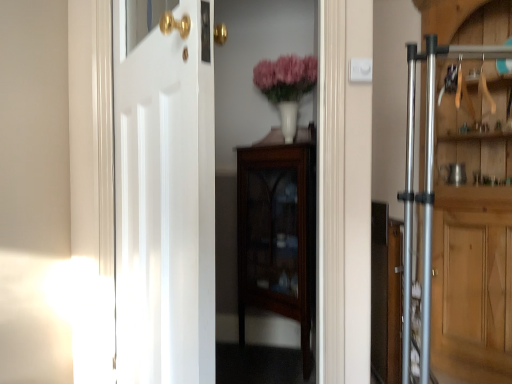
Question: Considering the relative sizes of pink matte vase at upper center and silver metallic door at right, the 2th door in the front-to-back sequence, in the image provided, is pink matte vase at upper center bigger than silver metallic door at right, the 2th door in the front-to-back sequence,?

Choices:
 (A) no
 (B) yes

Answer: (A)

Question: From the image's perspective, would you say pink matte vase at upper center is shown under silver metallic door at right, the 1th door viewed from the right?

Choices:
 (A) no
 (B) yes

Answer: (A)

Question: From a real-world perspective, is pink matte vase at upper center physically below silver metallic door at right, which is the 1th door from back to front?

Choices:
 (A) yes
 (B) no

Answer: (B)

Question: Is pink matte vase at upper center closer to the viewer compared to silver metallic door at right, which is the 1th door from back to front?

Choices:
 (A) no
 (B) yes

Answer: (A)

Question: Is pink matte vase at upper center outside silver metallic door at right, which is the 1th door from back to front?

Choices:
 (A) no
 (B) yes

Answer: (B)

Question: Does pink matte vase at upper center touch silver metallic door at right, which is the 1th door from back to front?

Choices:
 (A) yes
 (B) no

Answer: (B)

Question: Is silver metallic door at right, the second door viewed from the left, positioned with its back to pink matte vase at upper center?

Choices:
 (A) no
 (B) yes

Answer: (A)

Question: Is silver metallic door at right, the 2th door in the front-to-back sequence, closer to the viewer compared to pink matte vase at upper center?

Choices:
 (A) yes
 (B) no

Answer: (A)

Question: From the image's perspective, is silver metallic door at right, which is the 1th door from back to front, on pink matte vase at upper center?

Choices:
 (A) yes
 (B) no

Answer: (B)

Question: Is silver metallic door at right, the 2th door in the front-to-back sequence, not close to pink matte vase at upper center?

Choices:
 (A) yes
 (B) no

Answer: (B)

Question: Is silver metallic door at right, the 1th door viewed from the right, completely or partially outside of pink matte vase at upper center?

Choices:
 (A) yes
 (B) no

Answer: (A)

Question: Can you confirm if silver metallic door at right, the second door viewed from the left, is positioned to the right of pink matte vase at upper center?

Choices:
 (A) no
 (B) yes

Answer: (B)

Question: Is the depth of pink matte vase at upper center less than that of mahogany glass-front cabinet at center?

Choices:
 (A) no
 (B) yes

Answer: (A)